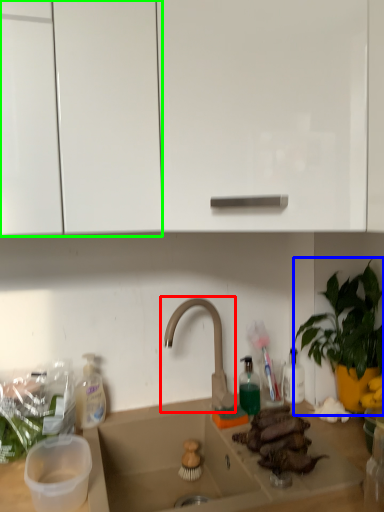
Question: Which object is positioned closest to tap (highlighted by a red box)? Select from houseplant (highlighted by a blue box) and cabinetry (highlighted by a green box).

Choices:
 (A) houseplant
 (B) cabinetry

Answer: (A)